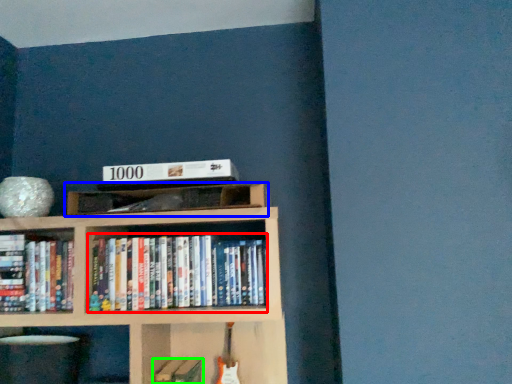
Question: Considering the real-world distances, which object is closest to book (highlighted by a red box)? shelf (highlighted by a blue box) or book (highlighted by a green box).

Choices:
 (A) shelf
 (B) book

Answer: (A)